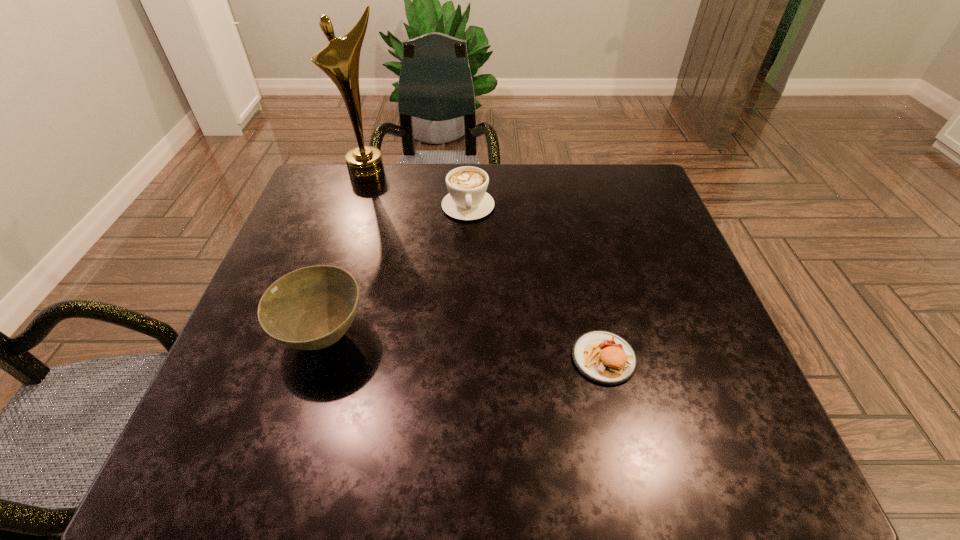
Image resolution: width=960 pixels, height=540 pixels. In order to click on free spot between the patty and the tallest object in this screenshot , I will do click(486, 266).

The image size is (960, 540). I want to click on free space between the second farthest object and the bowl, so click(396, 272).

At what (x,y) coordinates should I click in order to perform the action: click on free space between the award and the cappuccino. Please return your answer as a coordinate pair (x, y). Looking at the image, I should click on (419, 190).

Locate an element on the screen. free spot between the second shortest object and the patty is located at coordinates (536, 282).

The height and width of the screenshot is (540, 960). In order to click on empty space between the farthest object and the cappuccino in this screenshot , I will do `click(419, 190)`.

This screenshot has height=540, width=960. Identify the location of empty space that is in between the award and the bowl. 346,255.

Identify the location of vacant space in between the rightmost object and the cappuccino. The width and height of the screenshot is (960, 540). (536, 282).

Identify the location of free area in between the tallest object and the cappuccino. The width and height of the screenshot is (960, 540). (419, 190).

The height and width of the screenshot is (540, 960). I want to click on empty space between the rightmost object and the third tallest object, so click(536, 282).

You are a GUI agent. You are given a task and a screenshot of the screen. Output one action in this format:
    pyautogui.click(x=<x>, y=<y>)
    Task: Click on the free space between the award and the second farthest object
    The width and height of the screenshot is (960, 540).
    Given the screenshot: What is the action you would take?
    pyautogui.click(x=419, y=190)